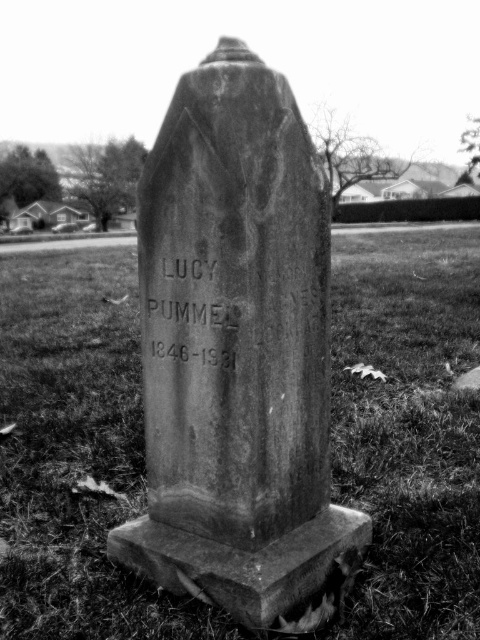
Between grassy at center and granite gravestone at center, which one appears on the left side from the viewer's perspective?

From the viewer's perspective, grassy at center appears more on the left side.

What do you see at coordinates (76, 454) in the screenshot? Image resolution: width=480 pixels, height=640 pixels. I see `grassy at center` at bounding box center [76, 454].

I want to click on grassy at center, so click(x=76, y=454).

Find the location of a particular element. grassy at center is located at coordinates (76, 454).